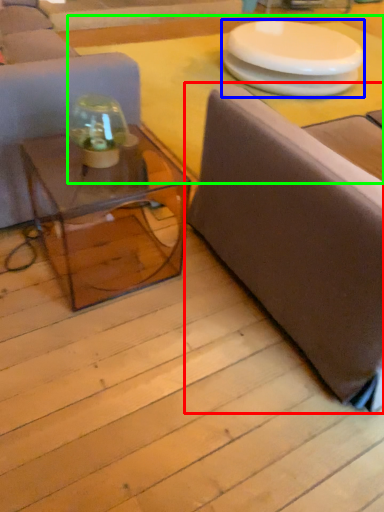
Question: Considering the real-world distances, which object is farthest from studio couch (highlighted by a red box)? round table (highlighted by a blue box) or table top (highlighted by a green box)?

Choices:
 (A) round table
 (B) table top

Answer: (A)